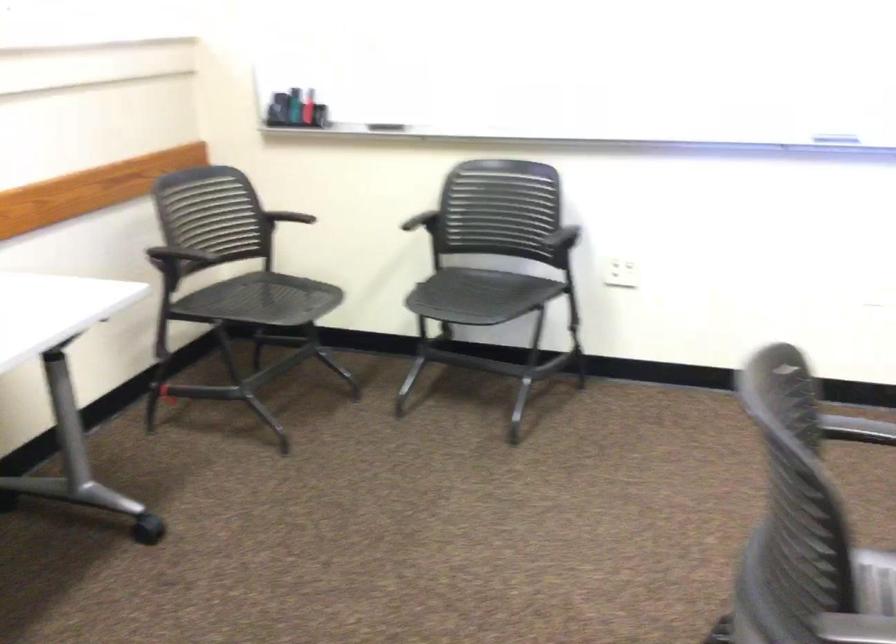
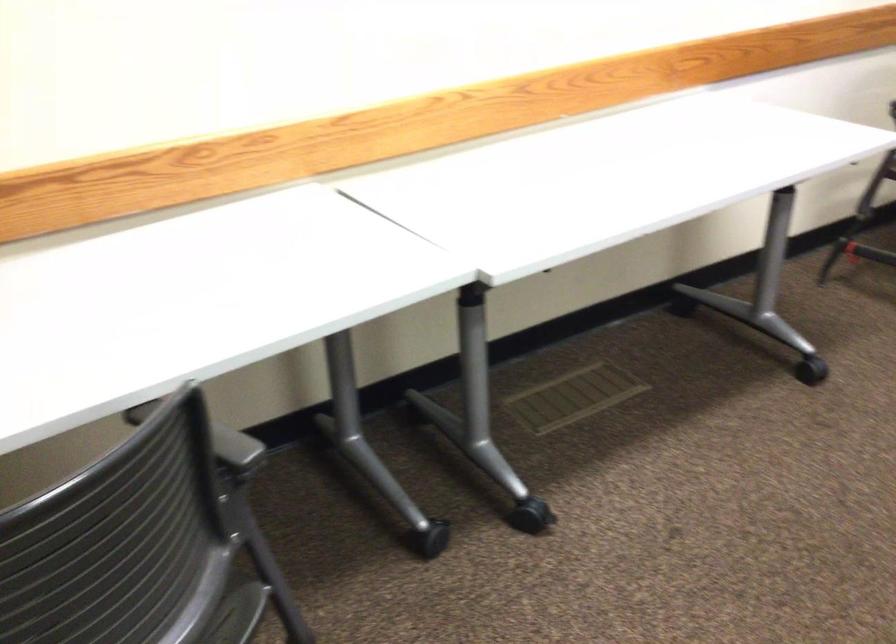
Question: The images are taken continuously from a first-person perspective. In which direction is your viewpoint rotating?

Choices:
 (A) Left
 (B) Right
 (C) Up
 (D) Down

Answer: (A)